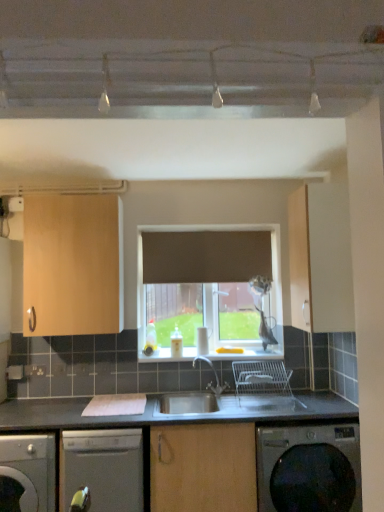
Question: Can you confirm if satin silver sink at center is taller than satin silver dishwasher at lower center, acting as the second dishwasher starting from the left?

Choices:
 (A) no
 (B) yes

Answer: (A)

Question: Is satin silver sink at center oriented towards satin silver dishwasher at lower center, acting as the second dishwasher starting from the left?

Choices:
 (A) no
 (B) yes

Answer: (A)

Question: Would you say satin silver sink at center is outside satin silver dishwasher at lower center, acting as the second dishwasher starting from the left?

Choices:
 (A) yes
 (B) no

Answer: (A)

Question: Is satin silver dishwasher at lower center, the 1th dishwasher viewed from the right, a part of satin silver sink at center?

Choices:
 (A) no
 (B) yes

Answer: (A)

Question: From the image's perspective, would you say satin silver sink at center is positioned over satin silver dishwasher at lower center, the 1th dishwasher viewed from the right?

Choices:
 (A) yes
 (B) no

Answer: (A)

Question: Considering the relative positions of satin silver sink at center and satin silver dishwasher at lower center, the 1th dishwasher viewed from the right, in the image provided, is satin silver sink at center to the right of satin silver dishwasher at lower center, the 1th dishwasher viewed from the right, from the viewer's perspective?

Choices:
 (A) no
 (B) yes

Answer: (B)

Question: Considering the relative sizes of matte wood cabinet at right, the second cabinetry when ordered from left to right, and satin silver sink at center in the image provided, is matte wood cabinet at right, the second cabinetry when ordered from left to right, wider than satin silver sink at center?

Choices:
 (A) yes
 (B) no

Answer: (B)

Question: Is matte wood cabinet at right, the second cabinetry when ordered from left to right, to the right of satin silver sink at center from the viewer's perspective?

Choices:
 (A) no
 (B) yes

Answer: (B)

Question: Is matte wood cabinet at right, placed as the first cabinetry when sorted from right to left, shorter than satin silver sink at center?

Choices:
 (A) no
 (B) yes

Answer: (A)

Question: From a real-world perspective, does matte wood cabinet at right, the second cabinetry when ordered from left to right, sit lower than satin silver sink at center?

Choices:
 (A) no
 (B) yes

Answer: (A)

Question: Is the depth of matte wood cabinet at right, placed as the first cabinetry when sorted from right to left, less than that of satin silver sink at center?

Choices:
 (A) yes
 (B) no

Answer: (B)

Question: Is matte wood cabinet at right, the second cabinetry when ordered from left to right, touching satin silver sink at center?

Choices:
 (A) no
 (B) yes

Answer: (A)

Question: Is light wood cabinet at upper left, which ranks as the 2th cabinetry in right-to-left order, thinner than dark gray metallic washing machine at lower right?

Choices:
 (A) no
 (B) yes

Answer: (B)